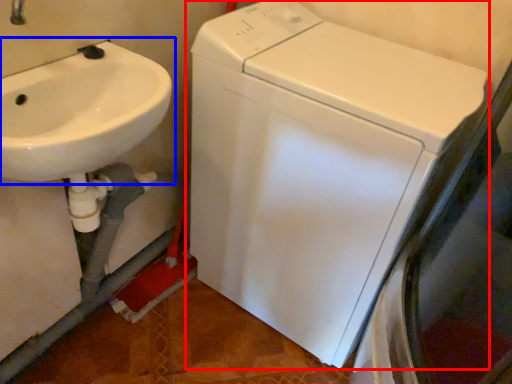
Question: Which object appears farthest to the camera in this image, washing machine (highlighted by a red box) or sink (highlighted by a blue box)?

Choices:
 (A) washing machine
 (B) sink

Answer: (A)